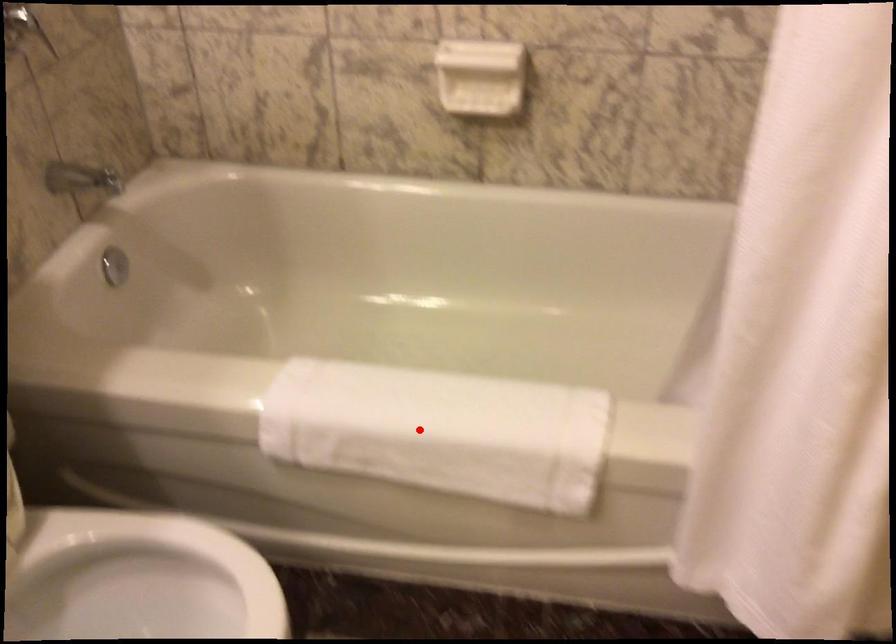
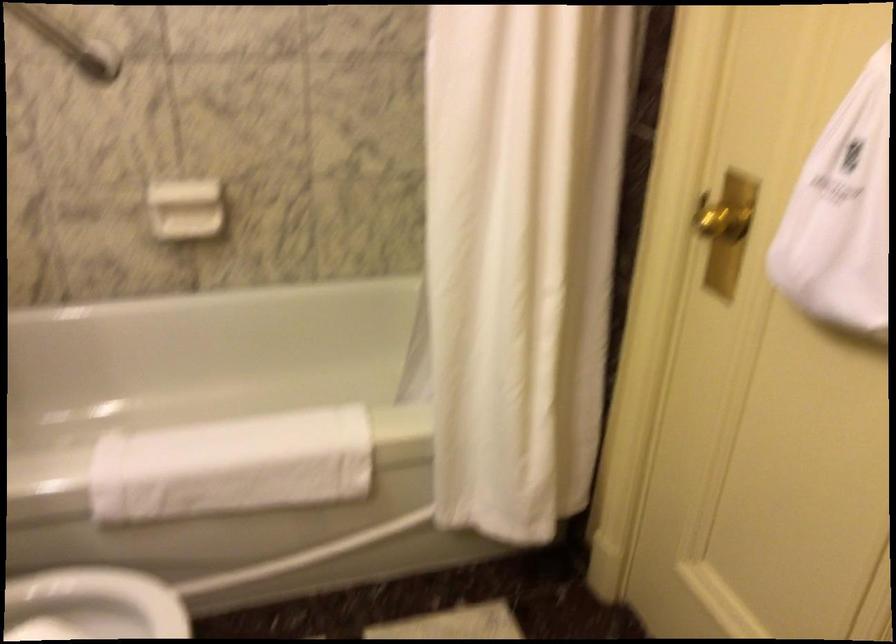
Where in the second image is the point corresponding to the highlighted location from the first image?

(231, 466)